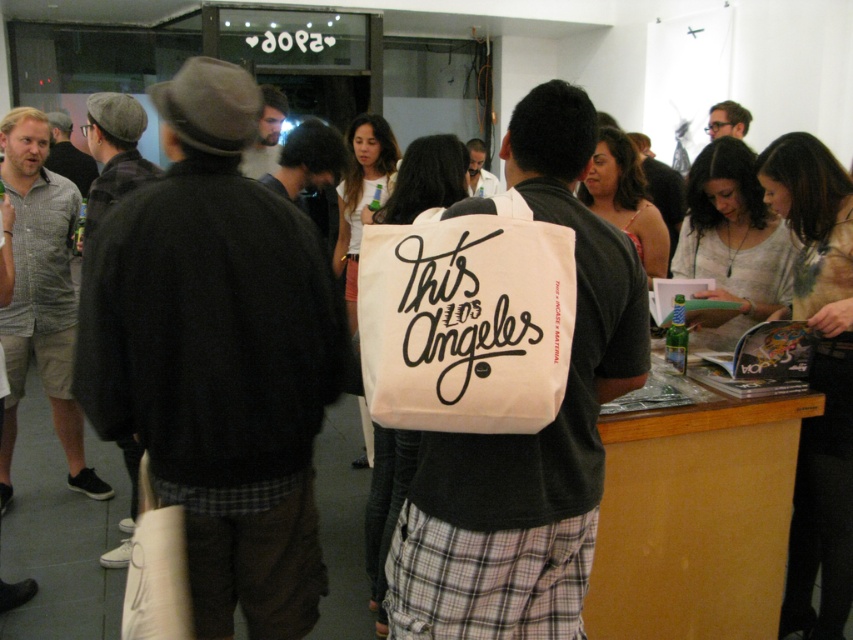
You are observing a person in the image and notice the checkered cotton shirt at left and the matte black glasses at upper center. Which object is positioned higher in the image?

The matte black glasses at upper center are positioned higher than the checkered cotton shirt at left.

You are a photographer trying to capture a candid shot of the light beige shirt at center without the white canvas tote at center blocking the view. Is this possible given their positions?

The white canvas tote at center is closer to the viewer than the light beige shirt at center, so the tote would block the view of the shirt. Therefore, it is not possible to capture the light beige shirt at center without the tote obstructing it.

What is the object located at the coordinate point (527, 435) in the image?

The object at coordinate point (527, 435) is the white canvas tote bag at center.